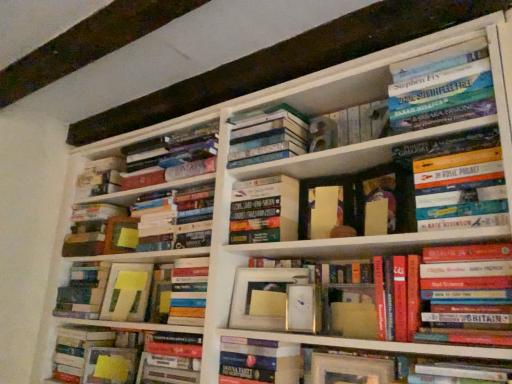
Question: Is matte yellow paper at center, the 1th paperback book in the back-to-front sequence, wider than matte yellow sticky notes at center, the 1th book when ordered from left to right?

Choices:
 (A) no
 (B) yes

Answer: (A)

Question: From the image's perspective, is matte yellow paper at center, the 2th paperback book positioned from the left, located beneath matte yellow sticky notes at center, which is the 12th book from right to left?

Choices:
 (A) yes
 (B) no

Answer: (B)

Question: From a real-world perspective, is matte yellow paper at center, the 1th paperback book in the back-to-front sequence, over matte yellow sticky notes at center, the 1th book when ordered from left to right?

Choices:
 (A) yes
 (B) no

Answer: (A)

Question: From the image's perspective, is matte yellow paper at center, the 2th paperback book positioned from the left, located above matte yellow sticky notes at center, the 1th book when ordered from left to right?

Choices:
 (A) no
 (B) yes

Answer: (B)

Question: Is there a large distance between matte yellow paper at center, the 1th paperback book in the back-to-front sequence, and matte yellow sticky notes at center, which is the 12th book from right to left?

Choices:
 (A) yes
 (B) no

Answer: (B)

Question: Does point (233, 208) appear closer or farther from the camera than point (194, 309)?

Choices:
 (A) farther
 (B) closer

Answer: (A)

Question: From a real-world perspective, is hardcover book at center, the sixth book when ordered from right to left, physically located above or below hardcover book at center, the 5th book when ordered from left to right?

Choices:
 (A) above
 (B) below

Answer: (A)

Question: From the image's perspective, is hardcover book at center, the sixth book when ordered from right to left, above or below hardcover book at center, the eighth book from the right?

Choices:
 (A) above
 (B) below

Answer: (A)

Question: In the image, is hardcover book at center, which appears as the 7th book when viewed from the left, positioned in front of or behind hardcover book at center, the eighth book from the right?

Choices:
 (A) front
 (B) behind

Answer: (A)

Question: Considering the positions of hardcover book at upper right, the second book in the right-to-left sequence, and hardcover book at center, placed as the fourth book when sorted from right to left, in the image, is hardcover book at upper right, the second book in the right-to-left sequence, bigger or smaller than hardcover book at center, placed as the fourth book when sorted from right to left,?

Choices:
 (A) small
 (B) big

Answer: (B)

Question: Considering the relative positions of hardcover book at upper right, acting as the eleventh book starting from the left, and hardcover book at center, placed as the fourth book when sorted from right to left, in the image provided, is hardcover book at upper right, acting as the eleventh book starting from the left, to the left or to the right of hardcover book at center, placed as the fourth book when sorted from right to left,?

Choices:
 (A) right
 (B) left

Answer: (A)

Question: From a real-world perspective, relative to hardcover book at center, placed as the ninth book when sorted from left to right, is hardcover book at upper right, the second book in the right-to-left sequence, vertically above or below?

Choices:
 (A) below
 (B) above

Answer: (B)

Question: Do you think hardcover book at upper right, the second book in the right-to-left sequence, is within hardcover book at center, placed as the ninth book when sorted from left to right, or outside of it?

Choices:
 (A) outside
 (B) inside

Answer: (A)

Question: From their relative heights in the image, would you say hardcover book at upper center, which ranks as the fifth book in right-to-left order, is taller or shorter than hardcover books at center, which is counted as the 3th book, starting from the right?

Choices:
 (A) tall
 (B) short

Answer: (B)

Question: From a real-world perspective, is hardcover book at upper center, the eighth book positioned from the left, physically located above or below hardcover books at center, which is counted as the 3th book, starting from the right?

Choices:
 (A) below
 (B) above

Answer: (B)